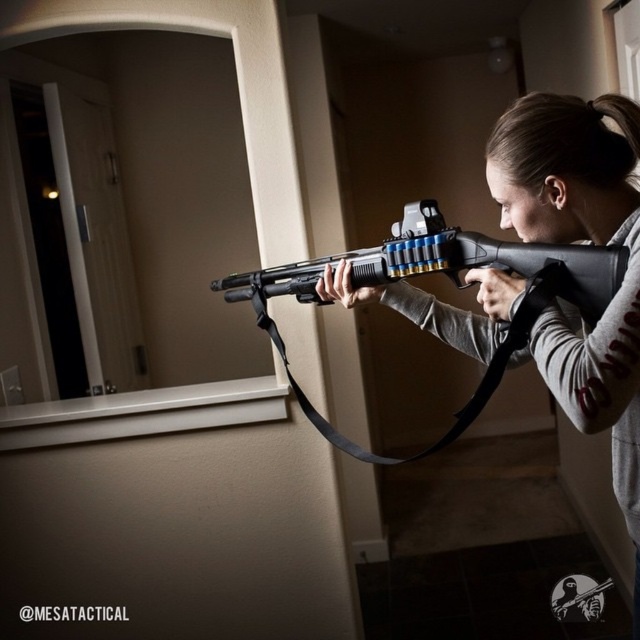
Question: Which point is farther from the camera taking this photo?

Choices:
 (A) (369, 260)
 (B) (624, 403)

Answer: (A)

Question: Which point appears farthest from the camera in this image?

Choices:
 (A) (593, 227)
 (B) (588, 292)

Answer: (A)

Question: Can you confirm if matte black shotgun at center is thinner than black matte shotgun at center?

Choices:
 (A) yes
 (B) no

Answer: (A)

Question: Which object is closer to the camera taking this photo?

Choices:
 (A) matte black shotgun at center
 (B) black matte shotgun at center

Answer: (A)

Question: Is matte black shotgun at center above black matte shotgun at center?

Choices:
 (A) no
 (B) yes

Answer: (A)

Question: Where is matte black shotgun at center located in relation to black matte shotgun at center in the image?

Choices:
 (A) right
 (B) left

Answer: (A)